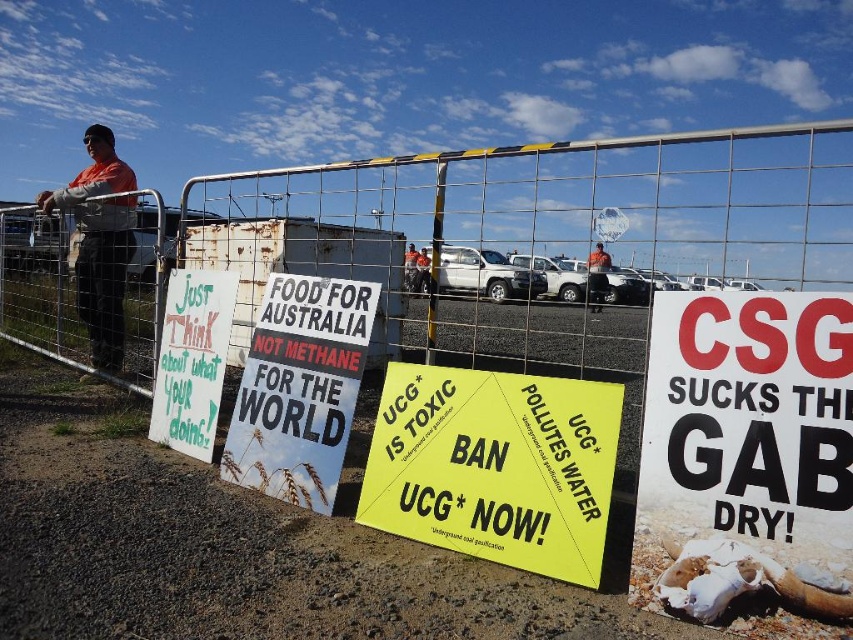
You are a photographer standing behind the metal fence in the image. You want to capture a photo that includes both the white paper sign at center right and the yellow paper sign at center. Based on their positions, which sign should you focus on first to ensure both are in frame?

You should focus on the yellow paper sign at center first since the white paper sign at center right is to its right, so adjusting the camera to include both would require framing from the leftmost point of the yellow sign to the rightmost point of the white sign.

You are a photographer trying to capture the protest scene. You notice the white paper sign at center right and the orange shirt at center. Which object should you focus on to ensure it appears larger in your photo?

The white paper sign at center right has a larger size compared to the orange shirt at center, so focusing on it will make it appear larger in the photo.